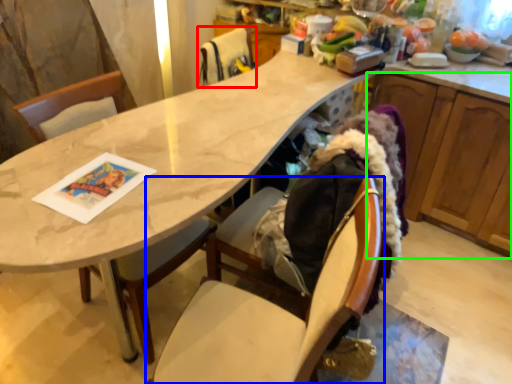
Question: Based on their relative distances, which object is farther from chair (highlighted by a red box)? Choose from chair (highlighted by a blue box) and cabinetry (highlighted by a green box).

Choices:
 (A) chair
 (B) cabinetry

Answer: (A)